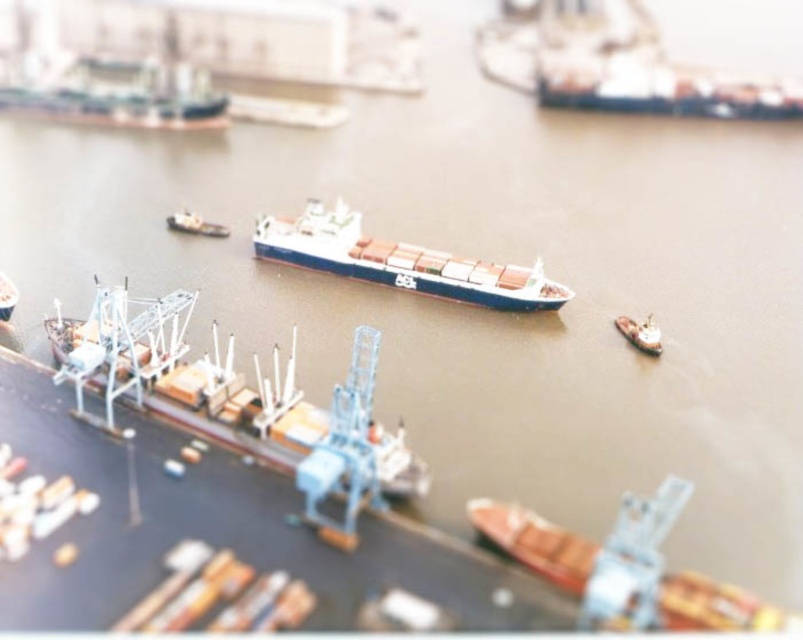
You are a port authority inspector reviewing the harbor layout. You need to ensure that the white matte cargo ship at lower left and the blue matte cargo ship at center are positioned correctly according to safety protocols. Based on their current arrangement, which ship is positioned closer to the left side of the harbor?

The white matte cargo ship at lower left is positioned to the left of the blue matte cargo ship at center, so it is closer to the left side of the harbor.